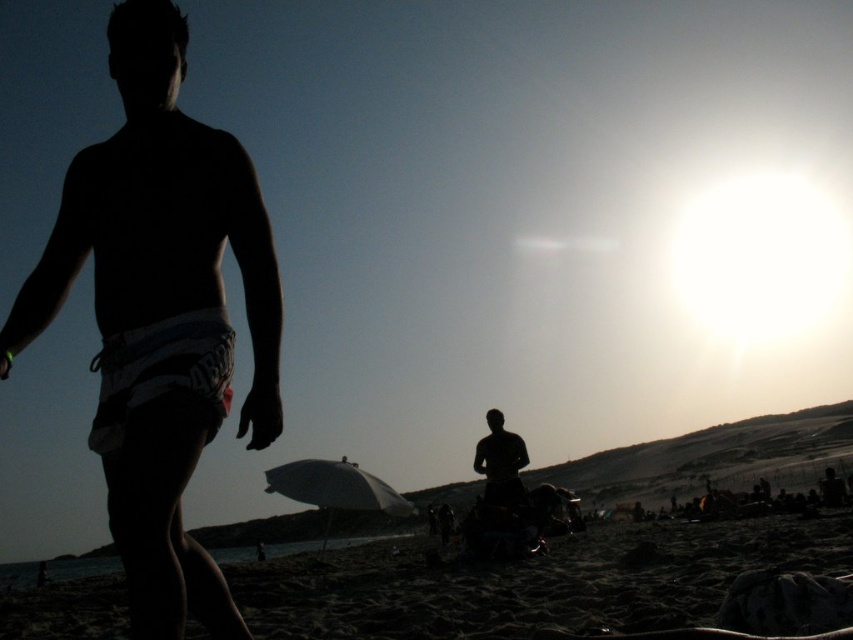
Question: Which of the following is the farthest from the observer?

Choices:
 (A) (497, 476)
 (B) (619, 586)

Answer: (A)

Question: Does silhouette shorts at left have a smaller size compared to silhouette figure at center?

Choices:
 (A) no
 (B) yes

Answer: (A)

Question: Which of the following is the closest to the observer?

Choices:
 (A) dark sand at lower center
 (B) silhouette figure at center
 (C) silhouette shorts at left

Answer: (C)

Question: Can you confirm if dark sand at lower center is wider than silhouette figure at center?

Choices:
 (A) yes
 (B) no

Answer: (A)

Question: Does silhouette shorts at left have a greater width compared to silhouette figure at center?

Choices:
 (A) no
 (B) yes

Answer: (B)

Question: Among these points, which one is farthest from the camera?

Choices:
 (A) (259, 211)
 (B) (396, 630)

Answer: (B)